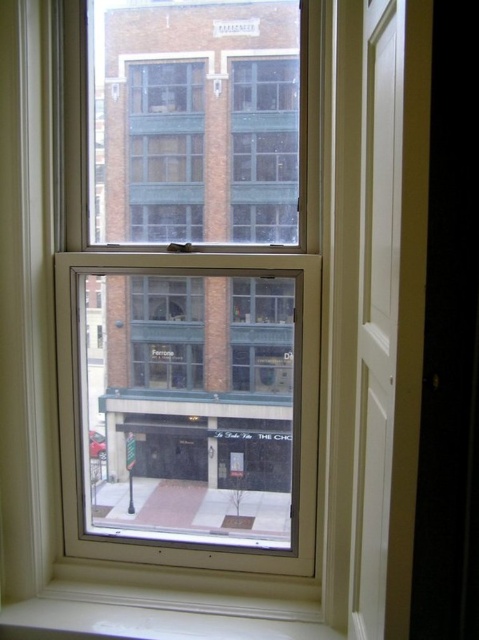
You are an interior designer assessing the placement of a new plant stand. You need to position it so that it is directly in front of the clear glass window at center but not blocking the white smooth window sill at lower center. Where should you place the plant stand?

Place the plant stand to the right of the white smooth window sill at lower center, as the clear glass window at center is positioned to the right of the white smooth window sill at lower center, allowing the plant stand to be in front of the window without blocking the sill.

You are an interior designer assessing the space. You need to hang a large painting that requires at least 1.5 meters in height. Based on the clear glass window at center and the white smooth window sill at lower center, which one has enough vertical space to accommodate the painting without overlapping the other?

The clear glass window at center has a greater height compared to the white smooth window sill at lower center. Therefore, the clear glass window at center likely provides sufficient vertical space to hang the painting without overlapping the window sill.

You are a window cleaner who needs to reach the clear glass window at center from the white smooth window sill at lower center. Can you reach it without any tools if your arm is 24 inches long?

The clear glass window at center is 25.04 inches from the white smooth window sill at lower center. Since your arm is only 24 inches long, you cannot reach it without tools.